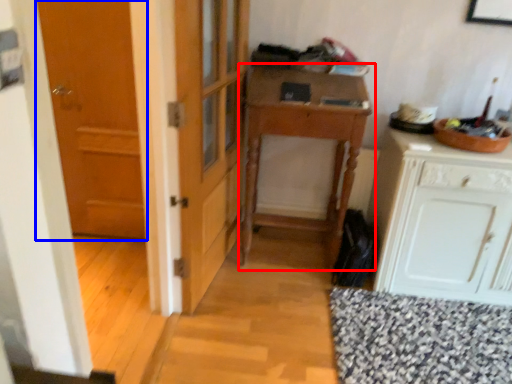
Question: Among these objects, which one is nearest to the camera, table (highlighted by a red box) or door (highlighted by a blue box)?

Choices:
 (A) table
 (B) door

Answer: (A)